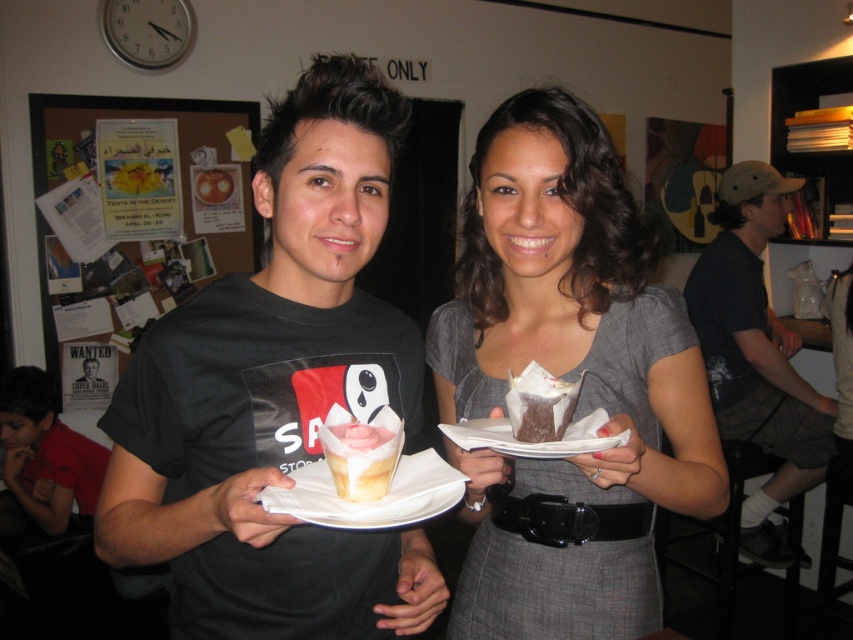
Question: Which point is closer to the camera?

Choices:
 (A) (717, 468)
 (B) (222, 140)
 (C) (543, 444)

Answer: (C)

Question: In this image, where is matte gray dress at center located relative to dark gray shorts at right?

Choices:
 (A) below
 (B) above

Answer: (B)

Question: Is matte gray dress at center closer to the viewer compared to dark gray shorts at right?

Choices:
 (A) no
 (B) yes

Answer: (B)

Question: Which is farther from the dark gray shorts at right?

Choices:
 (A) white paper plate at center
 (B) wooden corkboard at upper left
 (C) matte black t-shirt at center
 (D) matte gray dress at center

Answer: (C)

Question: Where is matte black t-shirt at center located in relation to matte gray dress at center in the image?

Choices:
 (A) above
 (B) below

Answer: (A)

Question: Which object is the farthest from the white paper plate at center?

Choices:
 (A) matte gray dress at center
 (B) matte black t-shirt at center
 (C) dark gray shorts at right
 (D) wooden corkboard at upper left

Answer: (D)